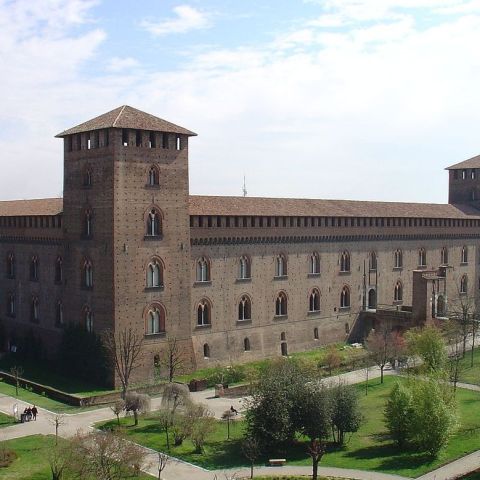
The height and width of the screenshot is (480, 480). What are the coordinates of `bench` in the screenshot? It's located at (280, 460).